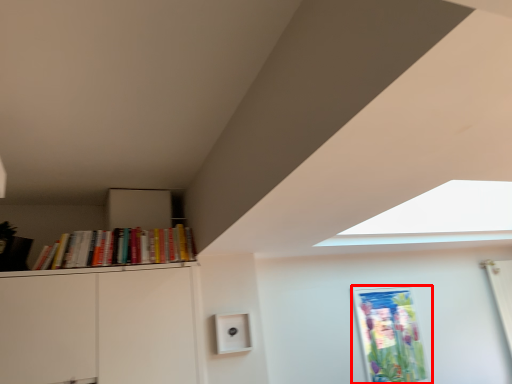
Question: In this image, where is picture frame (annotated by the red box) located relative to book?

Choices:
 (A) left
 (B) right

Answer: (B)